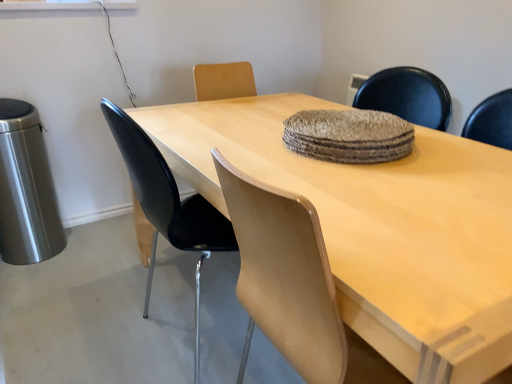
At what (x,y) coordinates should I click in order to perform the action: click on blank space to the left of black plastic chair at left. Please return your answer as a coordinate pair (x, y). The height and width of the screenshot is (384, 512). Looking at the image, I should click on (93, 324).